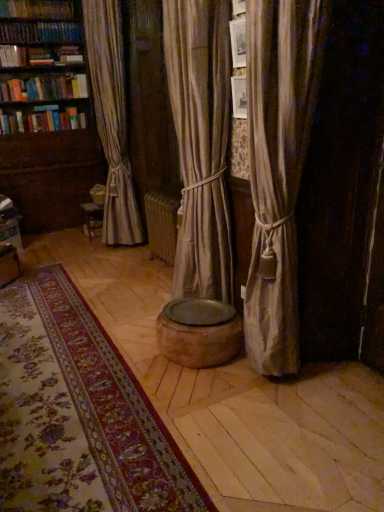
What are the coordinates of `vacant area situated below silky beige curtain at right (from a real-world perspective)` in the screenshot? It's located at (301, 379).